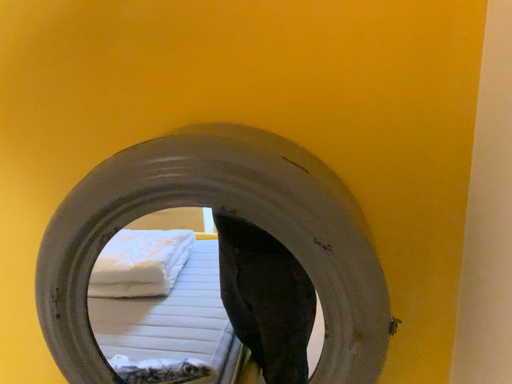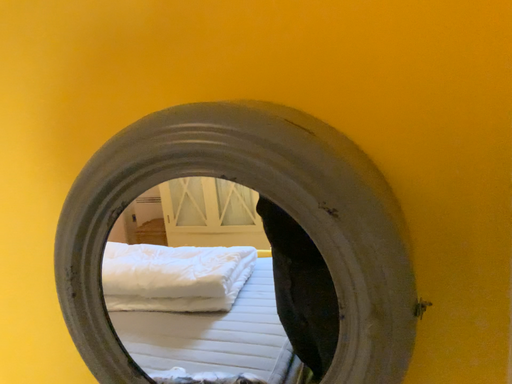
Question: Which way did the camera rotate in the video?

Choices:
 (A) rotated right
 (B) rotated left

Answer: (B)